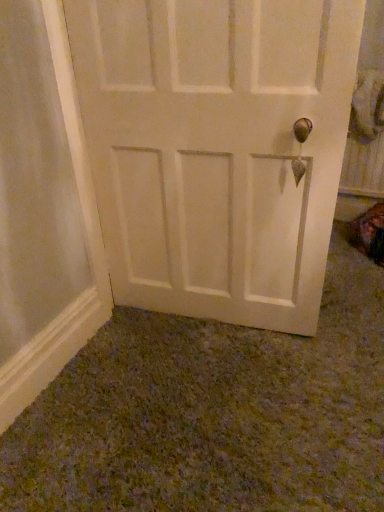
You are a GUI agent. You are given a task and a screenshot of the screen. Output one action in this format:
    pyautogui.click(x=<x>, y=<y>)
    Task: Click on the vacant area situated below white matte door at center (from a real-world perspective)
    The image size is (384, 512).
    Given the screenshot: What is the action you would take?
    pyautogui.click(x=221, y=324)